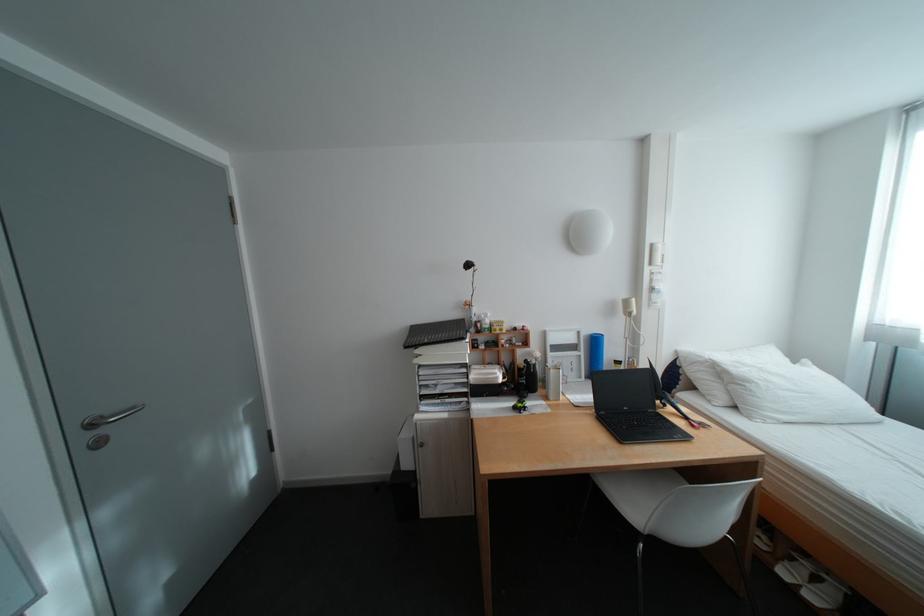
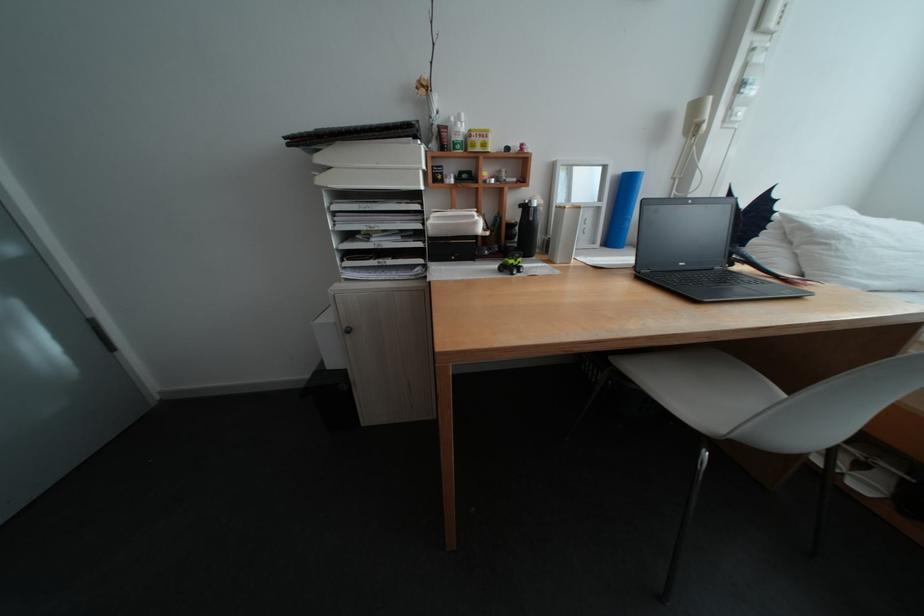
The point at [489,323] is marked in the first image. Where is the corresponding point in the second image?

(453, 128)